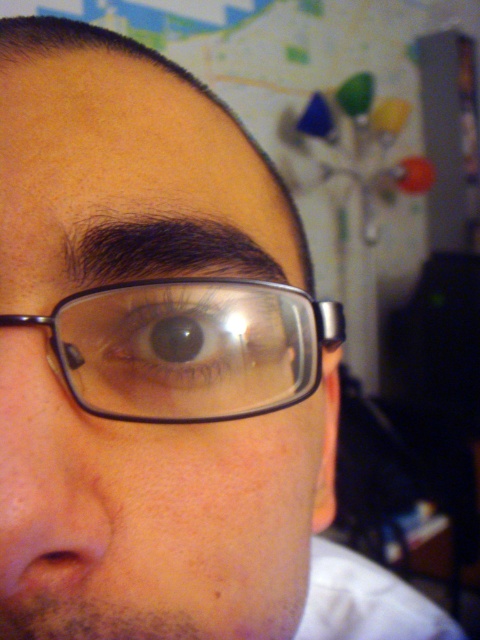
Between transparent plastic glasses at center and matte skin nose at lower left, which one appears on the right side from the viewer's perspective?

Positioned to the right is transparent plastic glasses at center.

Who is more forward, (154, 320) or (66, 467)?

Point (66, 467) is more forward.

Identify the location of transparent plastic glasses at center. (190, 348).

This screenshot has width=480, height=640. Identify the location of transparent plastic glasses at center. (190, 348).

Is clear plastic glasses at center to the right of transparent plastic glasses at center from the viewer's perspective?

Incorrect, clear plastic glasses at center is not on the right side of transparent plastic glasses at center.

Between point (205, 272) and point (201, 372), which one is positioned behind?

The point (205, 272) is more distant.

Who is more forward, (x=158, y=129) or (x=255, y=339)?

Point (x=255, y=339)

You are a GUI agent. You are given a task and a screenshot of the screen. Output one action in this format:
    pyautogui.click(x=<x>, y=<y>)
    Task: Click on the clear plastic glasses at center
    
    Given the screenshot: What is the action you would take?
    pyautogui.click(x=153, y=513)

Which of these two, clear plastic glasses at center or brown glossy eye at center, stands shorter?

brown glossy eye at center

Which of these two, clear plastic glasses at center or brown glossy eye at center, stands taller?

clear plastic glasses at center is taller.

Between point (148, 582) and point (168, 356), which one is positioned behind?

Positioned behind is point (168, 356).

The image size is (480, 640). I want to click on clear plastic glasses at center, so click(x=153, y=513).